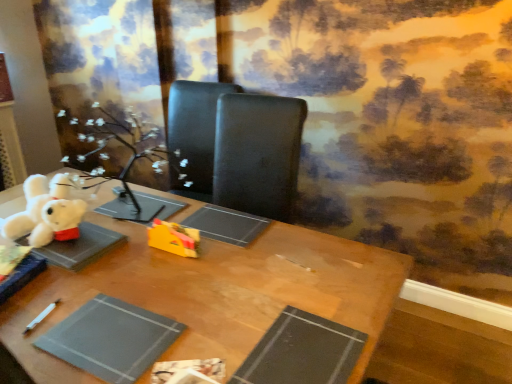
Where is `free space in front of yellow plastic toy at center, acting as the first toy starting from the right`? free space in front of yellow plastic toy at center, acting as the first toy starting from the right is located at coordinates (167, 279).